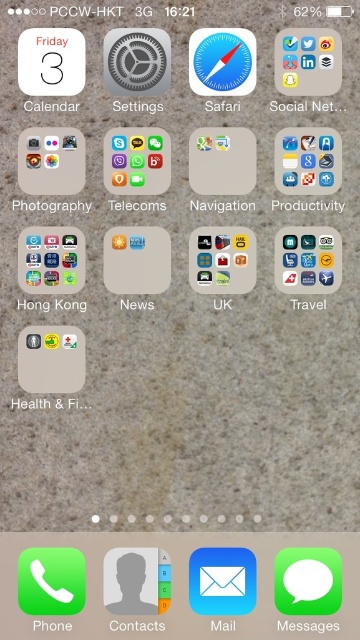
Question: Which point is closer to the camera?

Choices:
 (A) red rubber health & fi at lower left
 (B) red transparent text at upper left
 (C) black paper hong kong at center

Answer: (B)

Question: Observing the image, what is the correct spatial positioning of black paper hong kong at center in reference to textured gray settings at center?

Choices:
 (A) left
 (B) right

Answer: (A)

Question: Does green matte messages at bottom right appear under red transparent text at upper left?

Choices:
 (A) no
 (B) yes

Answer: (B)

Question: Which object is closer to the camera taking this photo?

Choices:
 (A) gray matte photography at upper left
 (B) red glossy navigation at center

Answer: (A)

Question: Does gray matte photography at upper left have a larger size compared to black paper hong kong at center?

Choices:
 (A) no
 (B) yes

Answer: (A)

Question: Among these objects, which one is nearest to the camera?

Choices:
 (A) gray matte photography at upper left
 (B) green matte messages at bottom right
 (C) black matte social net at upper right

Answer: (B)